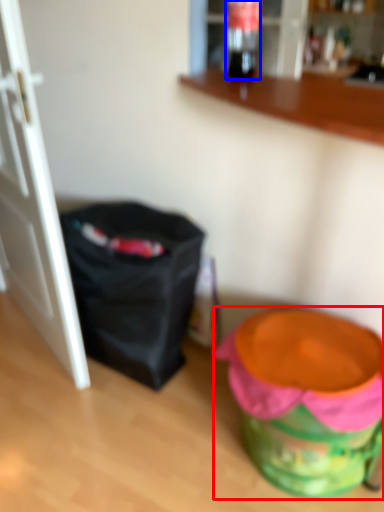
Question: Which point is closer to the camera, potty (highlighted by a red box) or beverage (highlighted by a blue box)?

Choices:
 (A) potty
 (B) beverage

Answer: (A)